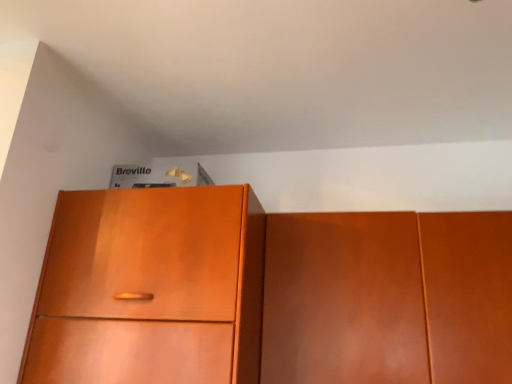
Measure the distance between point [506,340] and camera.

A distance of 3.99 feet exists between point [506,340] and camera.

What do you see at coordinates (388, 298) in the screenshot?
I see `matte wood cabinet at center` at bounding box center [388, 298].

In order to click on matte wood cabinet at center in this screenshot , I will do `click(388, 298)`.

At what (x,y) coordinates should I click in order to perform the action: click on matte wood cabinet at center. Please return your answer as a coordinate pair (x, y). This screenshot has height=384, width=512. Looking at the image, I should click on (388, 298).